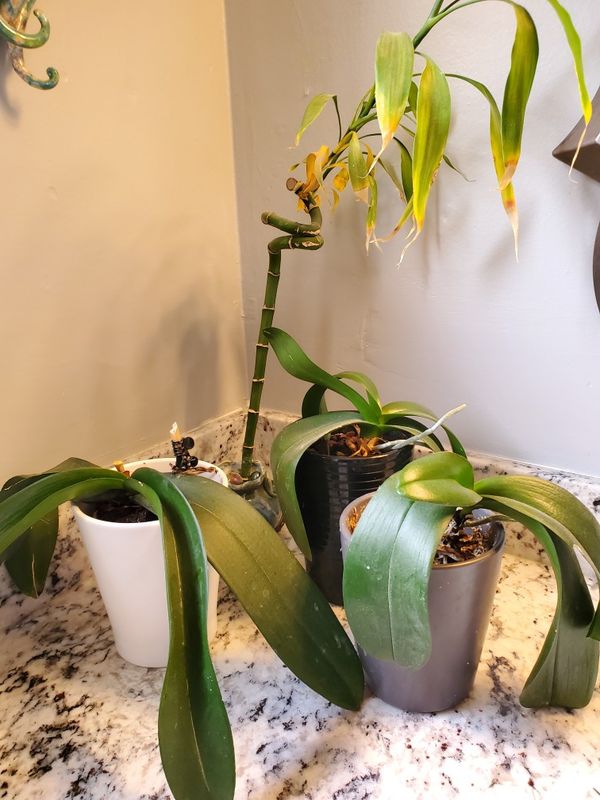
Locate an element on the screen. Image resolution: width=600 pixels, height=800 pixels. gray pot is located at coordinates (459, 586).